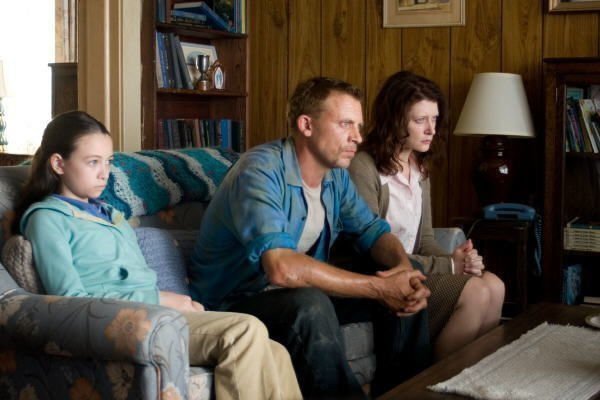
What are the coordinates of `coffee table` in the screenshot? It's located at (418, 393).